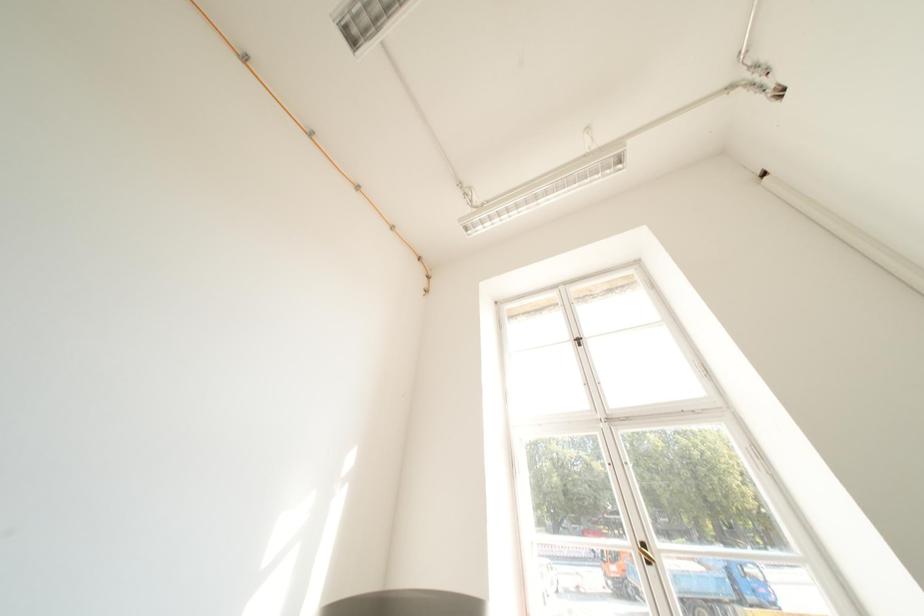
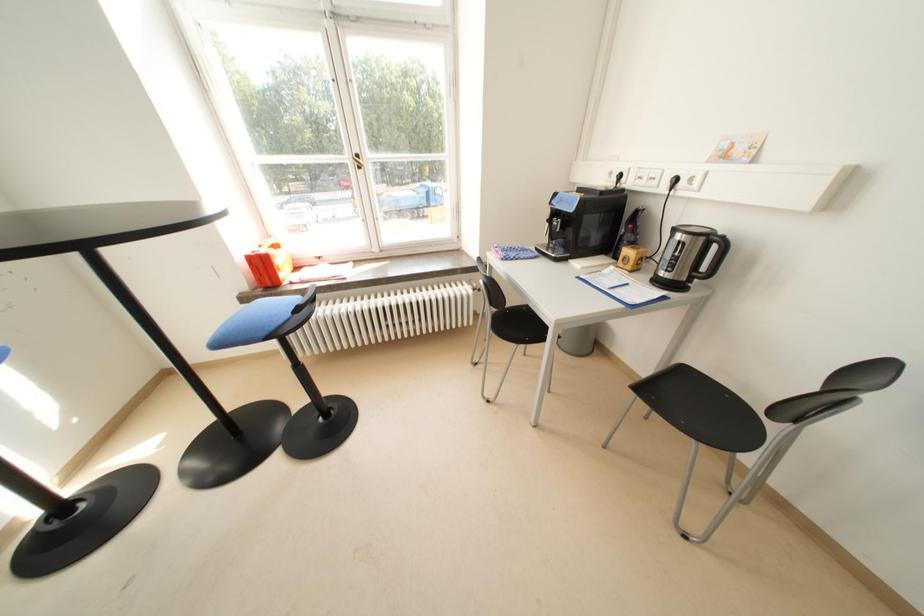
First-person continuous shooting, in which direction is the camera rotating?

The camera rotated toward right-down.